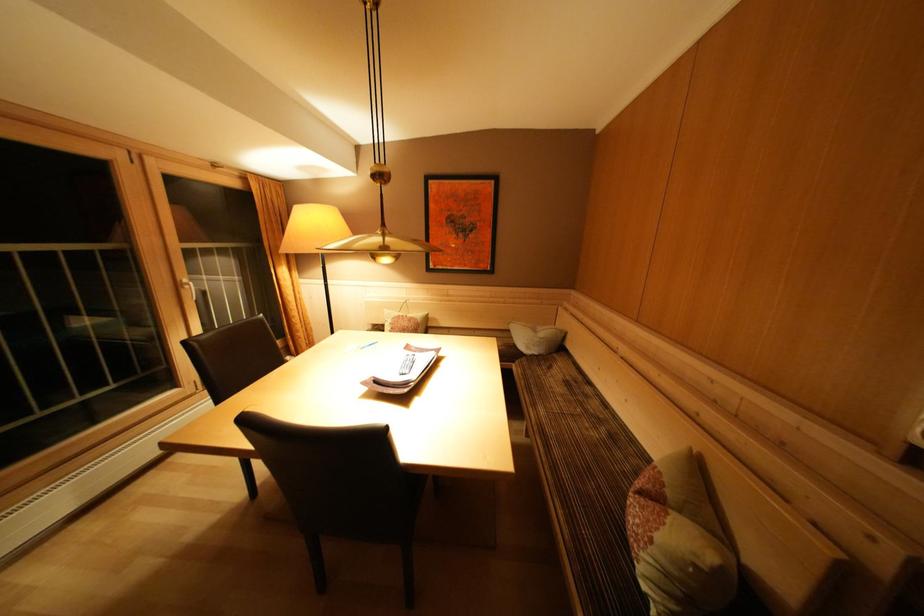
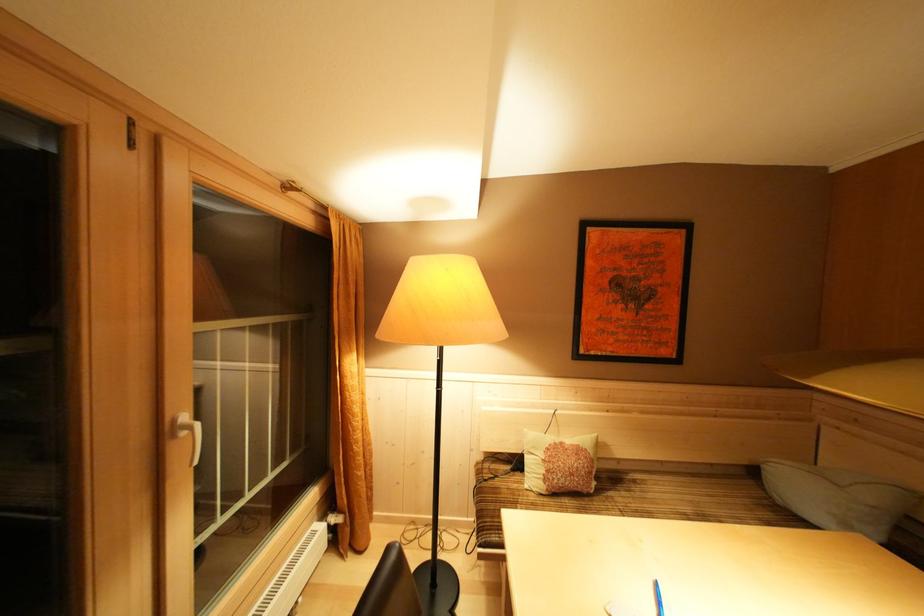
Locate, in the second image, the point that corresponds to the point at 549,339 in the first image.

(879, 503)